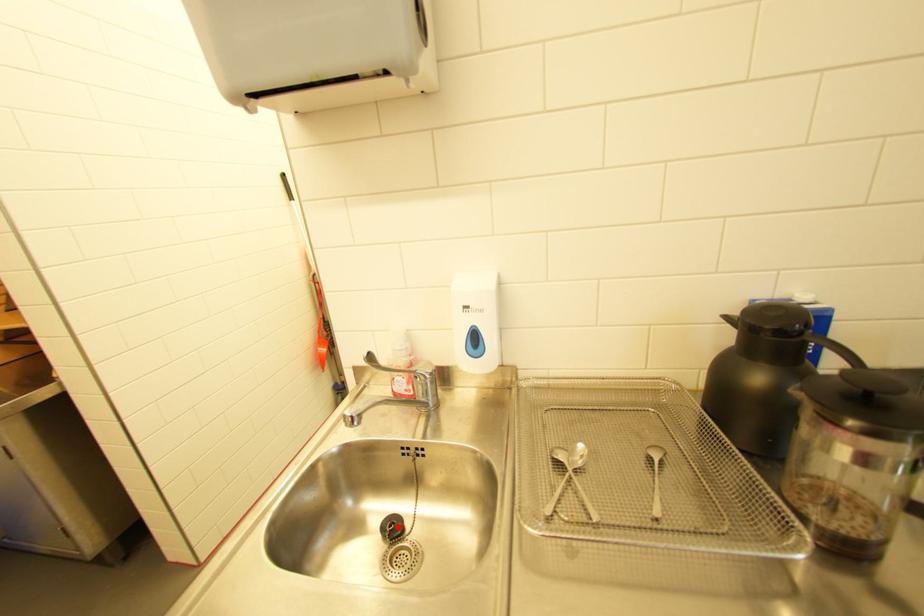
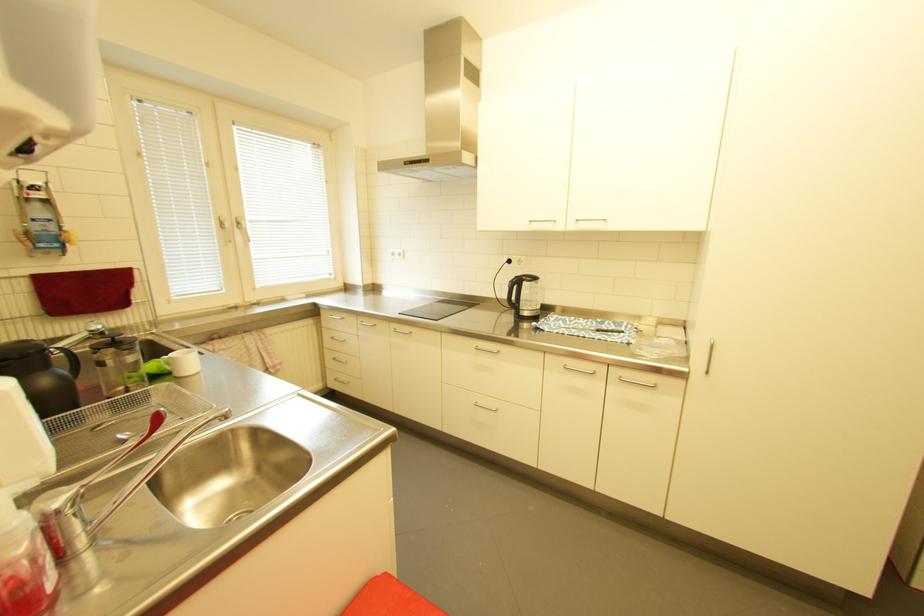
Question: I am providing you with two images of the same scene from different viewpoints. A red point is marked on the first image. Can you still see the location of the red point in image 2?

Choices:
 (A) Yes
 (B) No

Answer: (B)